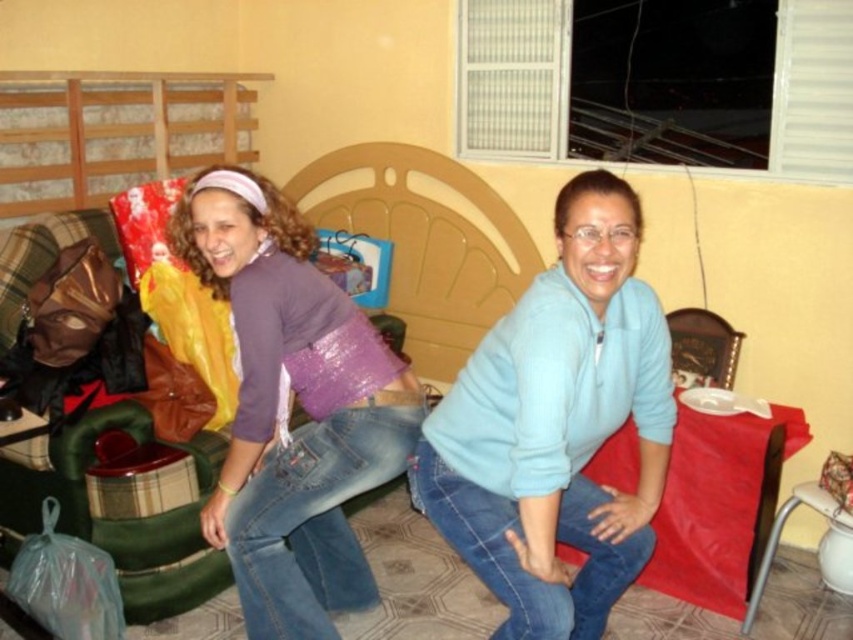
You are taking a photo of two people sitting in a living room. You want to focus on the person closer to the camera. Which point should you focus on, point (650, 541) or point (281, 378)?

You should focus on point (650, 541) because it is closer to the camera than point (281, 378).

You are a delivery robot with a 15 inch wide package. You need to move from the left side of the light blue fleece at center to the right side of the purple sequined purse at center. Can you fit through the space between them?

The distance between the light blue fleece at center and the purple sequined purse at center is 17.89 inches. Since the package is 15 inches wide, it can fit through the space between them.

You are a photographer trying to capture a candid shot of the two people in the scene. You notice the light blue fleece at center and the purple sequined purse at center. Which object should you position your camera closer to if you want to focus on the person on the right?

The light blue fleece at center is to the right of the purple sequined purse at center. Since the person on the right is closer to the light blue fleece at center, positioning the camera closer to the light blue fleece at center would allow better focus on them.